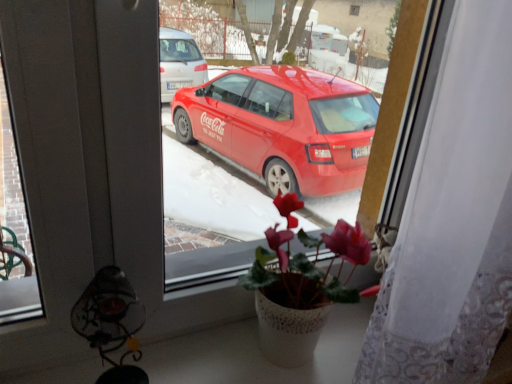
Question: Is white lace curtain at right in front of or behind pink matte cyclamen at center in the image?

Choices:
 (A) front
 (B) behind

Answer: (A)

Question: Is white lace curtain at right to the left or to the right of pink matte cyclamen at center in the image?

Choices:
 (A) left
 (B) right

Answer: (B)

Question: Based on their relative distances, which object is nearer to the metallic wire lamp at lower left?

Choices:
 (A) pink matte cyclamen at center
 (B) white lace curtain at right

Answer: (A)

Question: Which of these objects is positioned closest to the pink matte cyclamen at center?

Choices:
 (A) white lace curtain at right
 (B) metallic wire lamp at lower left

Answer: (A)